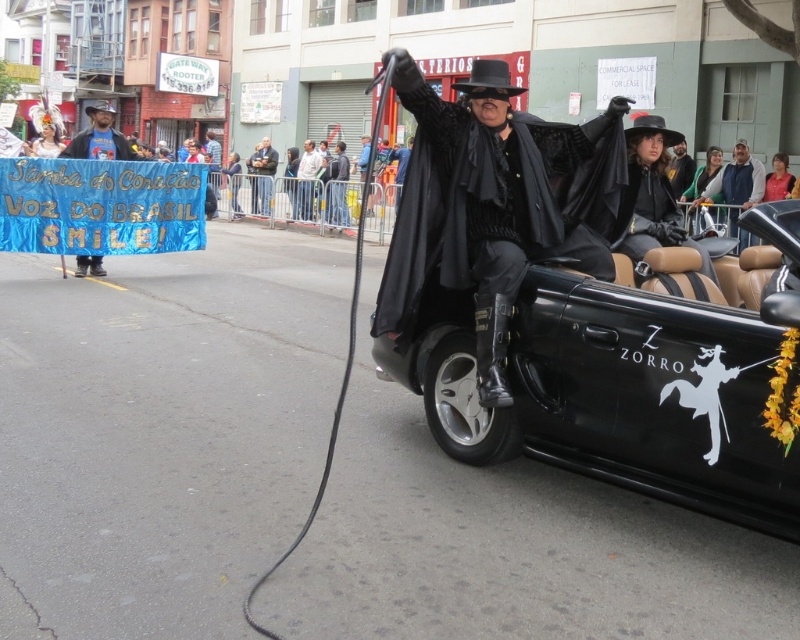
You are a photographer positioned at the origin point of the scene. The black leather convertible at center is at coordinates 0.608, 0.777. What direction should you move to get closer to the car?

To get closer to the black leather convertible at center located at coordinates (621, 388), you should move towards the center of the scene since the car is positioned there.

You are a photographer standing on the sidewalk trying to capture both the black leather convertible at center and the pink fabric shirt at upper right in a single photo. Given that your camera has a maximum focal length that allows capturing objects up to 10 meters apart, will you be able to include both subjects in the frame?

The black leather convertible at center and the pink fabric shirt at upper right are 9.83 meters apart, which is within the camera maximum focal length of 10 meters. Therefore, you can include both subjects in the frame.